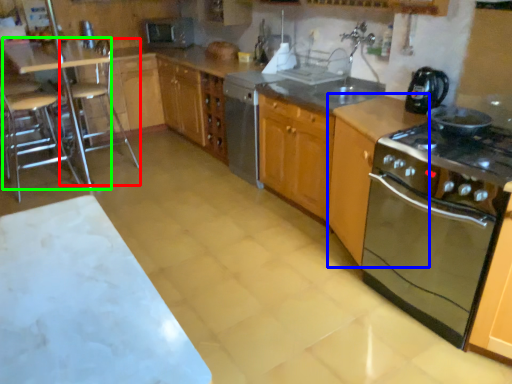
Question: Considering the real-world distances, which object is farthest from bar stool (highlighted by a red box)? cabinetry (highlighted by a blue box) or table (highlighted by a green box)?

Choices:
 (A) cabinetry
 (B) table

Answer: (A)